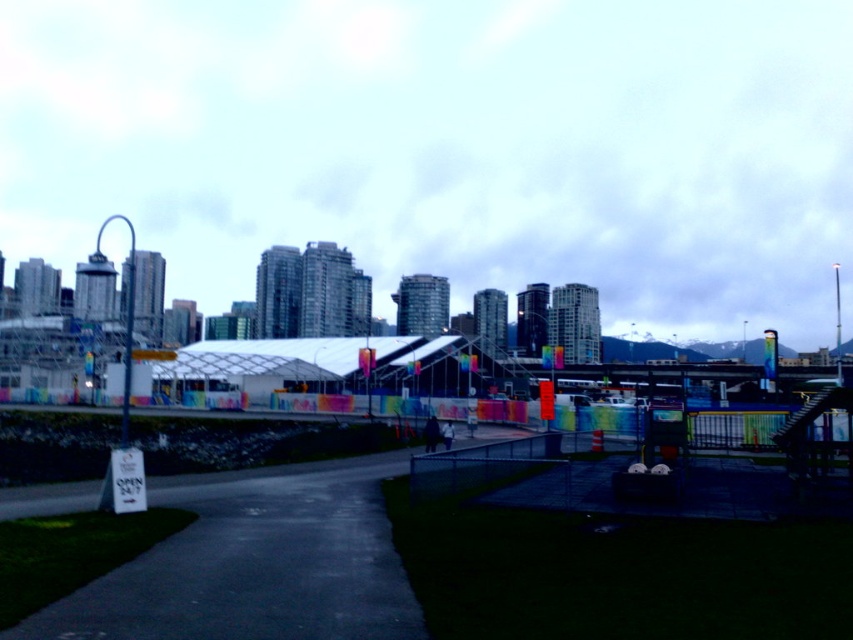
Between transparent glass canopy at center and dark asphalt path at center, which one has more height?

transparent glass canopy at center is taller.

Consider the image. Between transparent glass canopy at center and dark asphalt path at center, which one appears on the right side from the viewer's perspective?

transparent glass canopy at center

Locate an element on the screen. The image size is (853, 640). transparent glass canopy at center is located at coordinates (450, 147).

Identify the location of transparent glass canopy at center. The width and height of the screenshot is (853, 640). (450, 147).